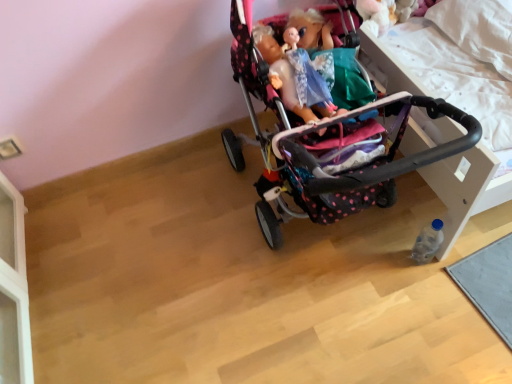
Question: Can you confirm if polka dot fabric stroller at center is smaller than clear plastic bottle at lower right?

Choices:
 (A) no
 (B) yes

Answer: (A)

Question: From a real-world perspective, does polka dot fabric stroller at center stand above clear plastic bottle at lower right?

Choices:
 (A) yes
 (B) no

Answer: (A)

Question: Can you confirm if polka dot fabric stroller at center is positioned to the left of clear plastic bottle at lower right?

Choices:
 (A) yes
 (B) no

Answer: (A)

Question: Can you confirm if polka dot fabric stroller at center is positioned to the right of clear plastic bottle at lower right?

Choices:
 (A) yes
 (B) no

Answer: (B)

Question: From the image's perspective, does polka dot fabric stroller at center appear higher than clear plastic bottle at lower right?

Choices:
 (A) yes
 (B) no

Answer: (A)

Question: Is polka dot fabric stroller at center far away from clear plastic bottle at lower right?

Choices:
 (A) no
 (B) yes

Answer: (A)

Question: Can you confirm if clear plastic bottle at lower right is wider than polka dot fabric stroller at center?

Choices:
 (A) yes
 (B) no

Answer: (B)

Question: Would you say polka dot fabric stroller at center is part of clear plastic bottle at lower right's contents?

Choices:
 (A) no
 (B) yes

Answer: (A)

Question: Does clear plastic bottle at lower right come in front of polka dot fabric stroller at center?

Choices:
 (A) no
 (B) yes

Answer: (A)

Question: Is clear plastic bottle at lower right thinner than polka dot fabric stroller at center?

Choices:
 (A) yes
 (B) no

Answer: (A)

Question: Would you say clear plastic bottle at lower right is a long distance from polka dot fabric stroller at center?

Choices:
 (A) no
 (B) yes

Answer: (A)

Question: Is clear plastic bottle at lower right not inside polka dot fabric stroller at center?

Choices:
 (A) yes
 (B) no

Answer: (B)

Question: Would you say clear plastic bottle at lower right is to the left or to the right of polka dot fabric stroller at center in the picture?

Choices:
 (A) left
 (B) right

Answer: (B)